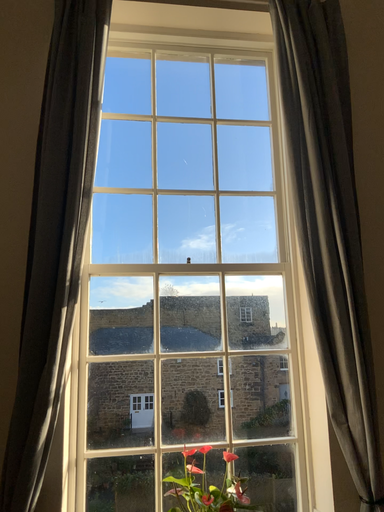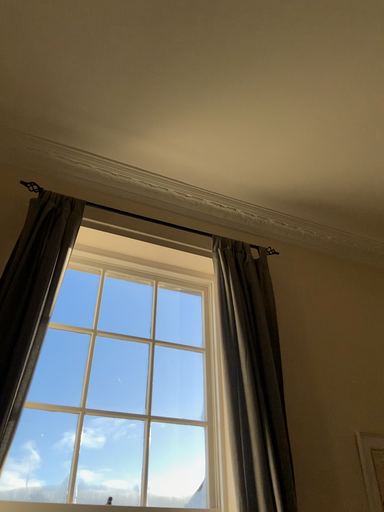
Question: Which way did the camera rotate in the video?

Choices:
 (A) rotated left
 (B) rotated right

Answer: (B)